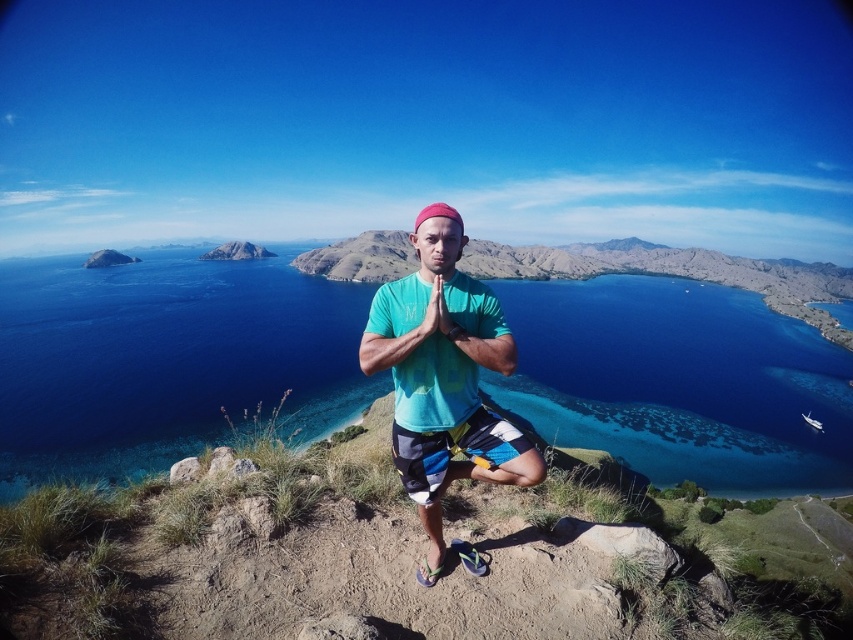
Question: Does blue water at center come in front of striped cotton shorts at center?

Choices:
 (A) no
 (B) yes

Answer: (A)

Question: Is blue water at center further to camera compared to teal cotton shirt at center?

Choices:
 (A) no
 (B) yes

Answer: (B)

Question: Which point is closer to the camera?

Choices:
 (A) (585, 307)
 (B) (409, 440)
 (C) (538, 476)

Answer: (C)

Question: Which point is farther to the camera?

Choices:
 (A) (589, 346)
 (B) (456, 307)

Answer: (A)

Question: Which object appears farthest from the camera in this image?

Choices:
 (A) blue water at center
 (B) striped cotton shorts at center

Answer: (A)

Question: Considering the relative positions of blue water at center and striped cotton shorts at center in the image provided, where is blue water at center located with respect to striped cotton shorts at center?

Choices:
 (A) left
 (B) right

Answer: (A)